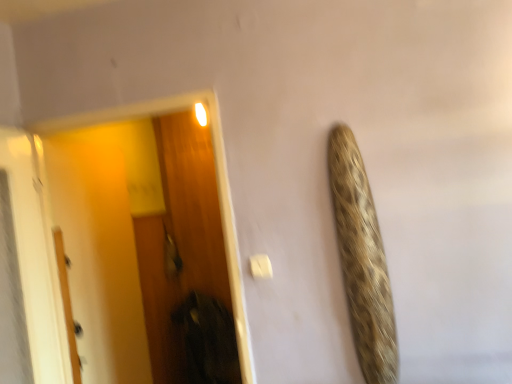
Image resolution: width=512 pixels, height=384 pixels. Describe the element at coordinates (67, 303) in the screenshot. I see `white matte door at left` at that location.

Find the location of a particular element. This screenshot has width=512, height=384. white matte door at left is located at coordinates (67, 303).

What is the approximate width of wooden screen door at left?

wooden screen door at left is 14.04 centimeters in width.

This screenshot has width=512, height=384. Identify the location of wooden screen door at left. (218, 192).

The width and height of the screenshot is (512, 384). What do you see at coordinates (218, 192) in the screenshot? I see `wooden screen door at left` at bounding box center [218, 192].

Where is `white matte door at left`? The width and height of the screenshot is (512, 384). white matte door at left is located at coordinates (67, 303).

From the picture: Considering the positions of objects white matte door at left and wooden screen door at left in the image provided, who is more to the left, white matte door at left or wooden screen door at left?

From the viewer's perspective, white matte door at left appears more on the left side.

Between white matte door at left and wooden screen door at left, which one is positioned behind?

white matte door at left.

Considering the points (66, 281) and (75, 119), which point is in front, point (66, 281) or point (75, 119)?

Positioned in front is point (75, 119).

From the image's perspective, which is above, white matte door at left or wooden screen door at left?

From the image's view, wooden screen door at left is above.

From a real-world perspective, is white matte door at left on wooden screen door at left?

No.

Considering the sizes of objects white matte door at left and wooden screen door at left in the image provided, who is thinner, white matte door at left or wooden screen door at left?

Thinner between the two is white matte door at left.

In the scene shown: Considering the sizes of white matte door at left and wooden screen door at left in the image, is white matte door at left taller or shorter than wooden screen door at left?

Considering their sizes, white matte door at left has less height than wooden screen door at left.

Considering the sizes of objects white matte door at left and wooden screen door at left in the image provided, who is bigger, white matte door at left or wooden screen door at left?

With larger size is wooden screen door at left.

Is white matte door at left spatially inside wooden screen door at left, or outside of it?

white matte door at left is located beyond the bounds of wooden screen door at left.

Is white matte door at left not close to wooden screen door at left?

No, there isn't a large distance between white matte door at left and wooden screen door at left.

Is white matte door at left turned away from wooden screen door at left?

No, wooden screen door at left is not at the back of white matte door at left.

Based on the photo, how many degrees apart are the facing directions of white matte door at left and wooden screen door at left?

The angular difference between white matte door at left and wooden screen door at left is 93.7 degrees.

How far apart are white matte door at left and wooden screen door at left?

white matte door at left and wooden screen door at left are 29.68 inches apart from each other.

Locate an element on the screen. The height and width of the screenshot is (384, 512). door behind the wooden screen door at left is located at coordinates (67, 303).

Which object is positioned more to the left, wooden screen door at left or white matte door at left?

white matte door at left.

Which object is closer to the camera, wooden screen door at left or white matte door at left?

wooden screen door at left.

Which point is more distant from viewer, (x=220, y=200) or (x=60, y=256)?

Positioned behind is point (x=220, y=200).

From the image's perspective, between wooden screen door at left and white matte door at left, who is located below?

From the image's view, white matte door at left is below.

From a real-world perspective, is wooden screen door at left located beneath white matte door at left?

No, from a real-world perspective, wooden screen door at left is not below white matte door at left.

Between wooden screen door at left and white matte door at left, which one has larger width?

With larger width is wooden screen door at left.

Can you confirm if wooden screen door at left is taller than white matte door at left?

Indeed, wooden screen door at left has a greater height compared to white matte door at left.

Does wooden screen door at left have a larger size compared to white matte door at left?

Correct, wooden screen door at left is larger in size than white matte door at left.

Choose the correct answer: Is wooden screen door at left inside white matte door at left or outside it?

wooden screen door at left exists outside the volume of white matte door at left.

Is wooden screen door at left directly adjacent to white matte door at left?

No.

Is wooden screen door at left oriented towards white matte door at left?

No, wooden screen door at left is not turned towards white matte door at left.

How many degrees apart are the facing directions of wooden screen door at left and white matte door at left?

There is a 93.7-degree angle between the facing directions of wooden screen door at left and white matte door at left.

Where is `door behind the wooden screen door at left`? The height and width of the screenshot is (384, 512). door behind the wooden screen door at left is located at coordinates (67, 303).

Locate an element on the screen. This screenshot has width=512, height=384. door on the left of wooden screen door at left is located at coordinates (67, 303).

Where is `door below the wooden screen door at left (from the image's perspective)`? The width and height of the screenshot is (512, 384). door below the wooden screen door at left (from the image's perspective) is located at coordinates (67, 303).